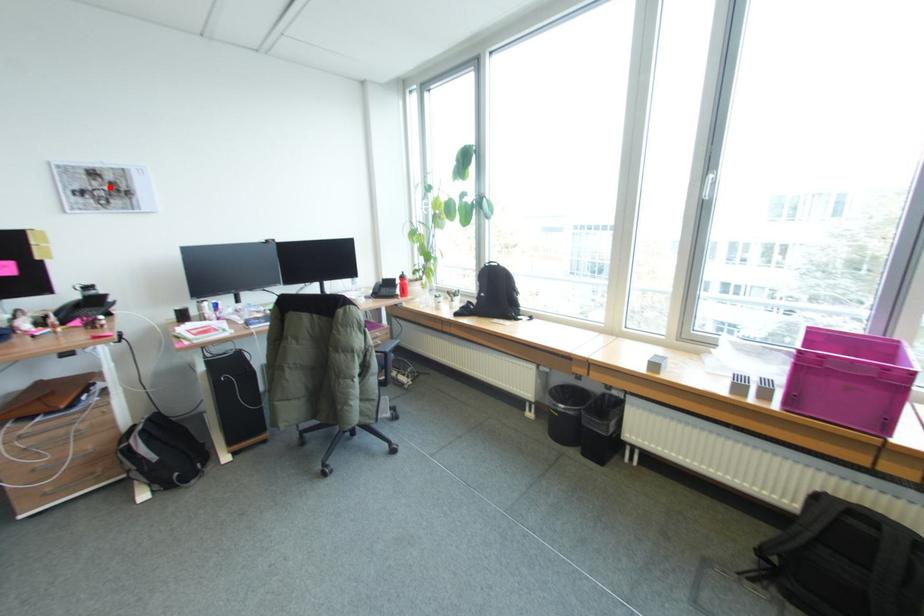
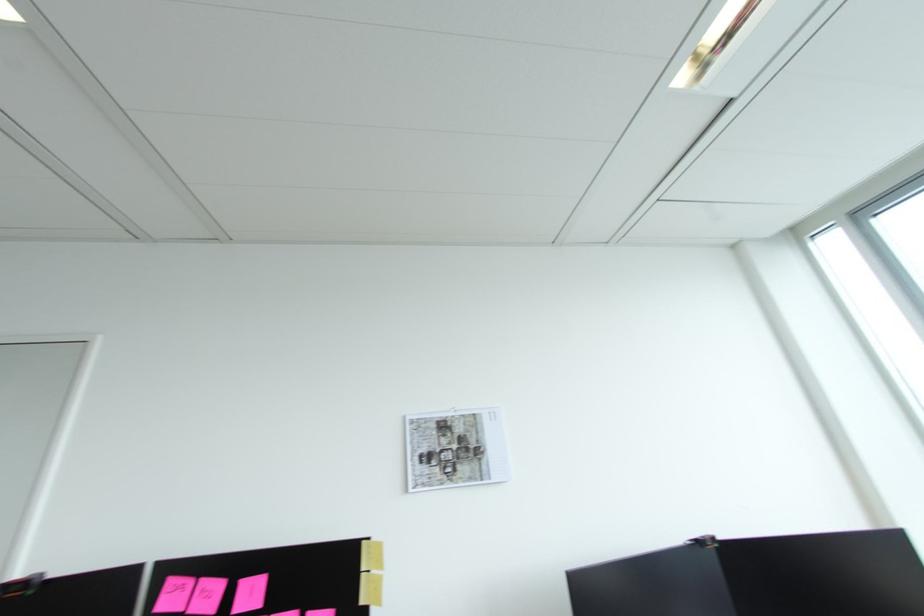
In the second image, find the point that corresponds to the highlighted location in the first image.

(459, 446)